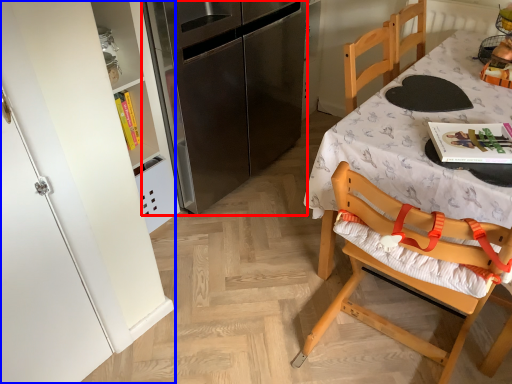
Question: Which object appears closest to the camera in this image, refrigerator (highlighted by a red box) or cabinetry (highlighted by a blue box)?

Choices:
 (A) refrigerator
 (B) cabinetry

Answer: (B)